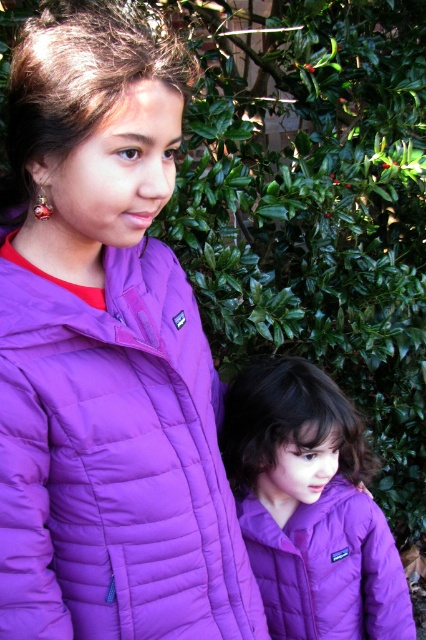
You are standing in a garden and see two points marked in the image. The first point is at coordinates point (52,566) and the second is at point (256,525). Which point is closer to you?

Point (52,566) is in front of point (256,525), so it is closer to you.

You are a photographer trying to capture a photo of the purple quilted jacket at left. What are the coordinates where you should aim your camera?

The purple quilted jacket at left is located at coordinates point (x=106, y=356).

You are planning to buy a purple quilted jacket for a friend who is taller than you. Based on the image, which purple quilted jacket at left or purple quilted jacket at center would be more suitable for their height?

The purple quilted jacket at center is wider than the purple quilted jacket at left, so it might be more suitable for your taller friend since it could provide a better fit for a larger frame.